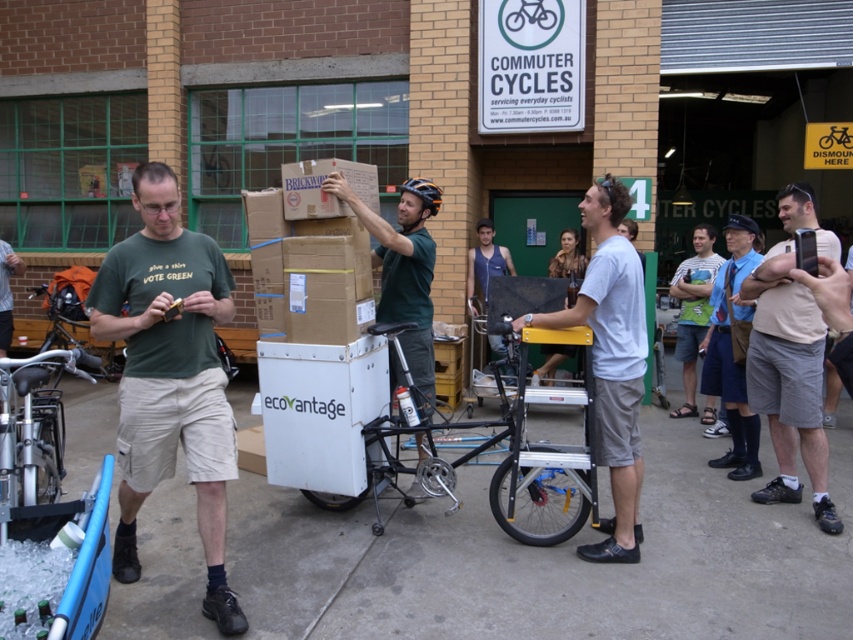
Consider the image. Between light beige shorts at right and blue fabric cap at upper right, which one is positioned higher?

Positioned higher is light beige shorts at right.

Is light beige shorts at right behind blue fabric cap at upper right?

No, light beige shorts at right is closer to the viewer.

Find the location of `light beige shorts at right`. light beige shorts at right is located at coordinates (790, 358).

Does point (723, 348) come farther from viewer compared to point (679, 266)?

No, it is in front of (679, 266).

Where is `blue fabric cap at upper right`? This screenshot has width=853, height=640. blue fabric cap at upper right is located at coordinates (732, 349).

The height and width of the screenshot is (640, 853). What do you see at coordinates (532, 477) in the screenshot?
I see `black matte cargo bike at center` at bounding box center [532, 477].

Does black matte cargo bike at center appear on the right side of blue fabric cap at upper right?

No, black matte cargo bike at center is not to the right of blue fabric cap at upper right.

Is point (508, 515) positioned after point (726, 410)?

No.

Find the location of a particular element. black matte cargo bike at center is located at coordinates (532, 477).